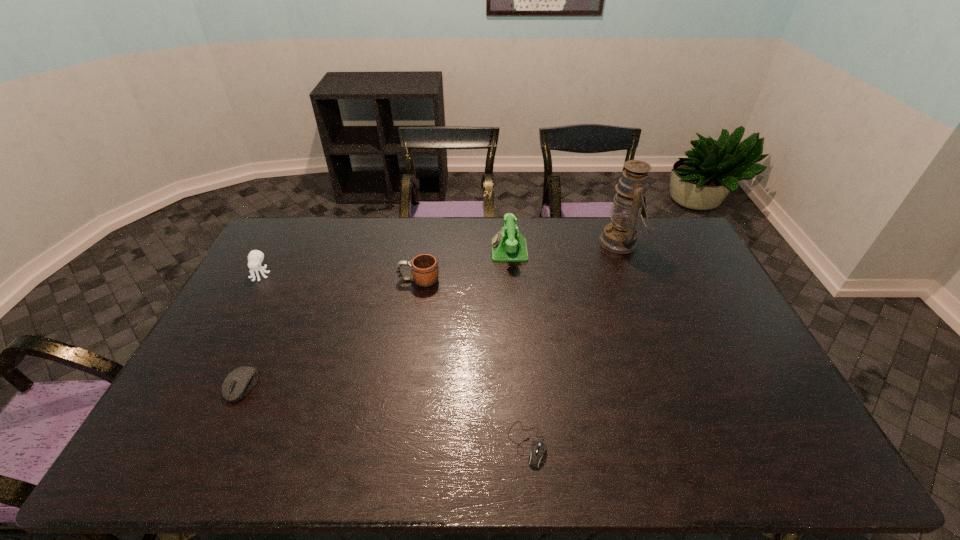
The height and width of the screenshot is (540, 960). Identify the location of free space located on the dial of the telephone. (429, 251).

You are a GUI agent. You are given a task and a screenshot of the screen. Output one action in this format:
    pyautogui.click(x=<x>, y=<y>)
    Task: Click on the free space located on the dial of the telephone
    
    Given the screenshot: What is the action you would take?
    pyautogui.click(x=407, y=251)

Locate an element on the screen. This screenshot has height=540, width=960. vacant space located on the dial of the telephone is located at coordinates (419, 251).

The image size is (960, 540). What are the coordinates of `vacant position located 0.380m on the front-facing side of the octopus` in the screenshot? It's located at (204, 375).

This screenshot has width=960, height=540. I want to click on vacant space located 0.280m on the side of the fourth object from right to left with the handle, so click(x=316, y=280).

I want to click on free space located 0.220m on the side of the fourth object from right to left with the handle, so click(x=333, y=280).

You are a GUI agent. You are given a task and a screenshot of the screen. Output one action in this format:
    pyautogui.click(x=<x>, y=<y>)
    Task: Click on the vacant space located 0.280m on the side of the fourth object from right to left with the handle
    This screenshot has width=960, height=540.
    Given the screenshot: What is the action you would take?
    pyautogui.click(x=316, y=280)

Find the location of a particular element. This screenshot has width=960, height=540. vacant space located 0.390m on the back of the taller computer mouse is located at coordinates (294, 276).

The image size is (960, 540). I want to click on free space located 0.300m on the right of the shorter computer mouse, so click(x=669, y=444).

Where is `oil lamp positioned at the far edge`? oil lamp positioned at the far edge is located at coordinates (620, 236).